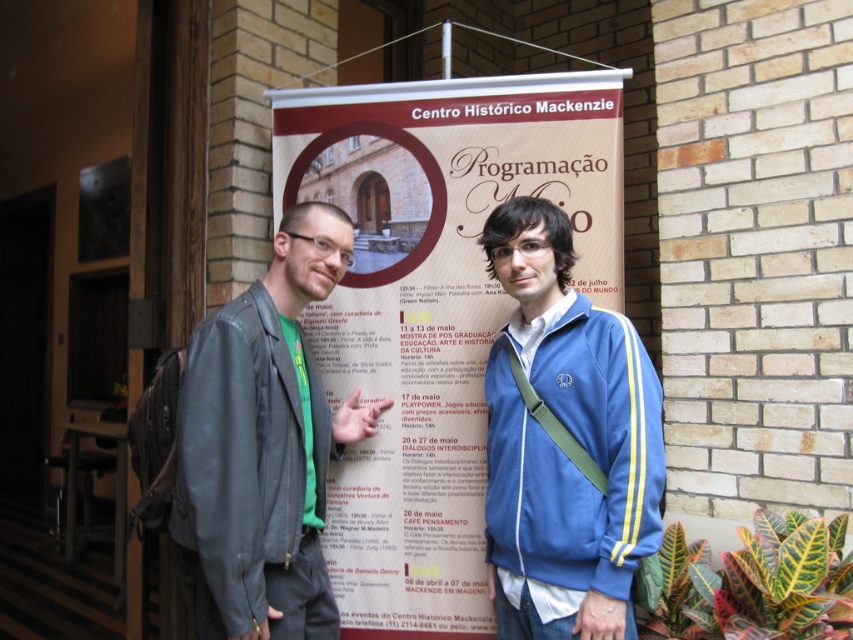
Can you confirm if blue fabric jacket at center is positioned above leather jacket at center?

Yes, blue fabric jacket at center is above leather jacket at center.

Image resolution: width=853 pixels, height=640 pixels. What do you see at coordinates (566, 442) in the screenshot?
I see `blue fabric jacket at center` at bounding box center [566, 442].

Between point (659, 522) and point (180, 556), which one is positioned behind?

Positioned behind is point (180, 556).

Identify the location of blue fabric jacket at center. (x=566, y=442).

Where is `matte paper banner at center`? This screenshot has height=640, width=853. matte paper banner at center is located at coordinates (433, 307).

Can you confirm if matte paper banner at center is positioned to the left of leather jacket at center?

Incorrect, matte paper banner at center is not on the left side of leather jacket at center.

What do you see at coordinates (433, 307) in the screenshot? I see `matte paper banner at center` at bounding box center [433, 307].

I want to click on matte paper banner at center, so click(433, 307).

Is matte paper banner at center positioned behind blue fabric jacket at center?

That is True.

Between matte paper banner at center and blue fabric jacket at center, which one appears on the right side from the viewer's perspective?

blue fabric jacket at center is more to the right.

You are a GUI agent. You are given a task and a screenshot of the screen. Output one action in this format:
    pyautogui.click(x=<x>, y=<y>)
    Task: Click on the matte paper banner at center
    The height and width of the screenshot is (640, 853).
    Given the screenshot: What is the action you would take?
    pyautogui.click(x=433, y=307)